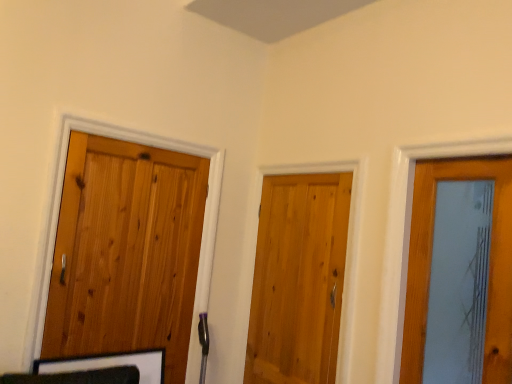
In order to click on natural wood door at center, the second door viewed from the left in this screenshot , I will do `click(298, 279)`.

Describe the element at coordinates (298, 279) in the screenshot. I see `natural wood door at center, the first door positioned from the right` at that location.

Describe the element at coordinates (126, 251) in the screenshot. I see `natural wood door at left, the 2th door viewed from the right` at that location.

Where is `natural wood door at left, the 1th door in the left-to-right sequence`? Image resolution: width=512 pixels, height=384 pixels. natural wood door at left, the 1th door in the left-to-right sequence is located at coordinates (126, 251).

You are a GUI agent. You are given a task and a screenshot of the screen. Output one action in this format:
    pyautogui.click(x=<x>, y=<y>)
    Task: Click on the natural wood door at center, the first door positioned from the right
    
    Given the screenshot: What is the action you would take?
    pyautogui.click(x=298, y=279)

Is natural wood door at left, the 1th door in the left-to-right sequence, at the right side of natural wood door at center, the second door viewed from the left?

No, natural wood door at left, the 1th door in the left-to-right sequence, is not to the right of natural wood door at center, the second door viewed from the left.

Considering their positions, is natural wood door at left, the 1th door in the left-to-right sequence, located in front of or behind natural wood door at center, the second door viewed from the left?

Visually, natural wood door at left, the 1th door in the left-to-right sequence, is located in front of natural wood door at center, the second door viewed from the left.

Is point (96, 275) farther from viewer compared to point (308, 383)?

No, (96, 275) is closer to viewer.

From the image's perspective, is natural wood door at left, the 2th door viewed from the right, above or below natural wood door at center, the second door viewed from the left?

Based on their image positions, natural wood door at left, the 2th door viewed from the right, is located above natural wood door at center, the second door viewed from the left.

From a real-world perspective, is natural wood door at left, the 2th door viewed from the right, on natural wood door at center, the second door viewed from the left?

Yes, from a real-world perspective, natural wood door at left, the 2th door viewed from the right, is above natural wood door at center, the second door viewed from the left.

Which object is thinner, natural wood door at left, the 2th door viewed from the right, or natural wood door at center, the first door positioned from the right?

natural wood door at center, the first door positioned from the right.

Is natural wood door at left, the 1th door in the left-to-right sequence, shorter than natural wood door at center, the first door positioned from the right?

In fact, natural wood door at left, the 1th door in the left-to-right sequence, may be taller than natural wood door at center, the first door positioned from the right.

Does natural wood door at left, the 1th door in the left-to-right sequence, have a smaller size compared to natural wood door at center, the first door positioned from the right?

Incorrect, natural wood door at left, the 1th door in the left-to-right sequence, is not smaller in size than natural wood door at center, the first door positioned from the right.

Is natural wood door at left, the 1th door in the left-to-right sequence, not within natural wood door at center, the first door positioned from the right?

Yes, natural wood door at left, the 1th door in the left-to-right sequence, is not within natural wood door at center, the first door positioned from the right.

Is natural wood door at left, the 2th door viewed from the right, next to natural wood door at center, the second door viewed from the left?

No, natural wood door at left, the 2th door viewed from the right, is not touching natural wood door at center, the second door viewed from the left.

Is natural wood door at left, the 1th door in the left-to-right sequence, facing towards natural wood door at center, the second door viewed from the left?

No, natural wood door at left, the 1th door in the left-to-right sequence, is not turned towards natural wood door at center, the second door viewed from the left.

What's the angular difference between natural wood door at left, the 1th door in the left-to-right sequence, and natural wood door at center, the second door viewed from the left,'s facing directions?

90.6 degrees.

Locate an element on the screen. The image size is (512, 384). door located in front of the natural wood door at center, the second door viewed from the left is located at coordinates (126, 251).

Does natural wood door at center, the first door positioned from the right, appear on the right side of natural wood door at left, the 2th door viewed from the right?

Correct, you'll find natural wood door at center, the first door positioned from the right, to the right of natural wood door at left, the 2th door viewed from the right.

Considering their positions, is natural wood door at center, the first door positioned from the right, located in front of or behind natural wood door at left, the 1th door in the left-to-right sequence?

In the image, natural wood door at center, the first door positioned from the right, appears behind natural wood door at left, the 1th door in the left-to-right sequence.

Does point (250, 377) come behind point (167, 353)?

Yes, point (250, 377) is farther from viewer.

From the image's perspective, is natural wood door at center, the first door positioned from the right, located above or below natural wood door at left, the 2th door viewed from the right?

natural wood door at center, the first door positioned from the right, is situated lower than natural wood door at left, the 2th door viewed from the right, in the image.

From a real-world perspective, which object rests below the other?

natural wood door at center, the first door positioned from the right, from a real-world perspective.

Is natural wood door at center, the first door positioned from the right, thinner than natural wood door at left, the 2th door viewed from the right?

Correct, the width of natural wood door at center, the first door positioned from the right, is less than that of natural wood door at left, the 2th door viewed from the right.

Consider the image. Can you confirm if natural wood door at center, the first door positioned from the right, is shorter than natural wood door at left, the 1th door in the left-to-right sequence?

Yes, natural wood door at center, the first door positioned from the right, is shorter than natural wood door at left, the 1th door in the left-to-right sequence.

Does natural wood door at center, the second door viewed from the left, have a larger size compared to natural wood door at left, the 1th door in the left-to-right sequence?

Actually, natural wood door at center, the second door viewed from the left, might be smaller than natural wood door at left, the 1th door in the left-to-right sequence.

Is natural wood door at left, the 1th door in the left-to-right sequence, a part of natural wood door at center, the second door viewed from the left?

No, natural wood door at left, the 1th door in the left-to-right sequence, is not inside natural wood door at center, the second door viewed from the left.

Is the surface of natural wood door at center, the second door viewed from the left, in direct contact with natural wood door at left, the 2th door viewed from the right?

No, natural wood door at center, the second door viewed from the left, is not touching natural wood door at left, the 2th door viewed from the right.

Is natural wood door at center, the first door positioned from the right, oriented away from natural wood door at left, the 2th door viewed from the right?

No, natural wood door at center, the first door positioned from the right,'s orientation is not away from natural wood door at left, the 2th door viewed from the right.

Can you tell me how much natural wood door at center, the first door positioned from the right, and natural wood door at left, the 2th door viewed from the right, differ in facing direction?

natural wood door at center, the first door positioned from the right, and natural wood door at left, the 2th door viewed from the right, are facing 90.6 degrees away from each other.

Where is `door above the natural wood door at center, the second door viewed from the left (from the image's perspective)`? The image size is (512, 384). door above the natural wood door at center, the second door viewed from the left (from the image's perspective) is located at coordinates (126, 251).

Where is `door below the natural wood door at left, the 2th door viewed from the right (from a real-world perspective)`? The image size is (512, 384). door below the natural wood door at left, the 2th door viewed from the right (from a real-world perspective) is located at coordinates (298, 279).

At what (x,y) coordinates should I click in order to perform the action: click on door below the natural wood door at left, the 1th door in the left-to-right sequence (from the image's perspective). Please return your answer as a coordinate pair (x, y). This screenshot has width=512, height=384. Looking at the image, I should click on (298, 279).